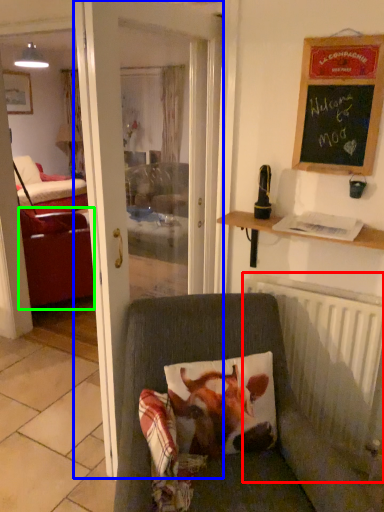
Question: Estimate the real-world distances between objects in this image. Which object is closer to radiator (highlighted by a red box), door (highlighted by a blue box) or studio couch (highlighted by a green box)?

Choices:
 (A) door
 (B) studio couch

Answer: (A)